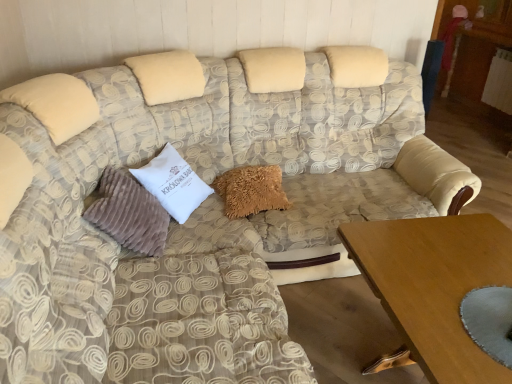
Question: From a real-world perspective, is fuzzy beige pillow at center, which appears as the 3th pillow when viewed from the left, above or below wooden table at lower right?

Choices:
 (A) below
 (B) above

Answer: (B)

Question: Visually, is fuzzy beige pillow at center, which appears as the 3th pillow when viewed from the left, positioned to the left or to the right of wooden table at lower right?

Choices:
 (A) left
 (B) right

Answer: (A)

Question: Based on their relative distances, which object is nearer to the fuzzy beige pillow at center, which appears as the 3th pillow when viewed from the left?

Choices:
 (A) suede-like beige pillow at left, the 1th pillow from the left
 (B) wooden table at lower right
 (C) white velvety pillow at center, the 2th pillow in the right-to-left sequence

Answer: (C)

Question: Which of these objects is positioned closest to the white velvety pillow at center, the 2th pillow in the right-to-left sequence?

Choices:
 (A) suede-like beige pillow at left, acting as the 3th pillow starting from the right
 (B) fuzzy beige pillow at center, the first pillow positioned from the right
 (C) wooden table at lower right

Answer: (A)